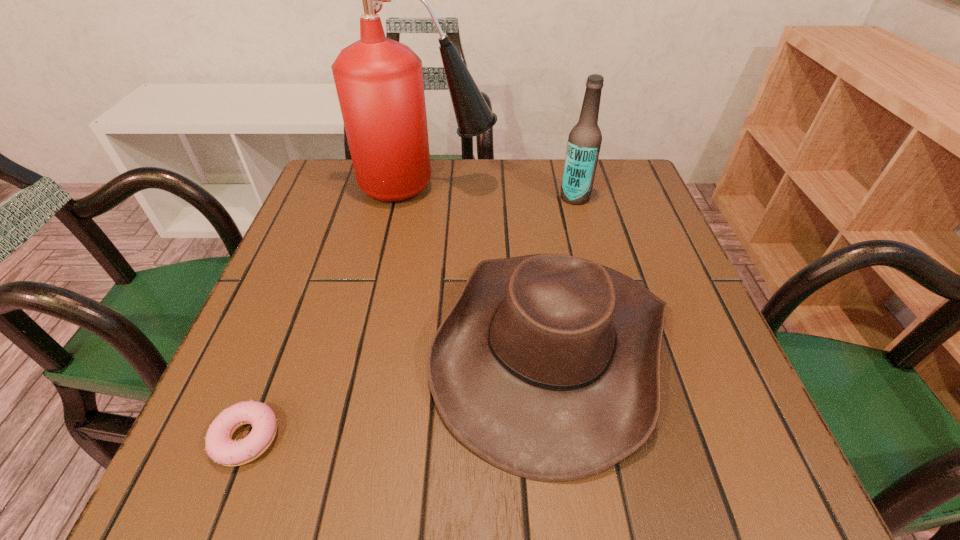
At what (x,y) coordinates should I click in order to perform the action: click on the tallest object. Please return your answer as a coordinate pair (x, y). Looking at the image, I should click on point(379,82).

Locate an element on the screen. The width and height of the screenshot is (960, 540). the second tallest object is located at coordinates (584, 142).

This screenshot has width=960, height=540. What are the coordinates of `cowboy hat` in the screenshot? It's located at (547, 366).

Where is `the shortest object`? the shortest object is located at coordinates (220, 447).

At what (x,y) coordinates should I click in order to perform the action: click on vacant space situated 0.240m with the nozzle aimed from the fire extinguisher. Please return your answer as a coordinate pair (x, y). This screenshot has height=540, width=960. Looking at the image, I should click on (591, 187).

I want to click on vacant space located 0.370m on the side of the third shortest object with the label, so click(x=407, y=197).

This screenshot has height=540, width=960. I want to click on vacant space situated on the side of the third shortest object with the label, so click(477, 197).

Locate an element on the screen. blank area located on the side of the third shortest object with the label is located at coordinates (420, 197).

The width and height of the screenshot is (960, 540). I want to click on free space located 0.320m on the back of the cowboy hat, so click(528, 173).

Locate an element on the screen. free location located 0.320m on the back of the doughnut is located at coordinates (314, 265).